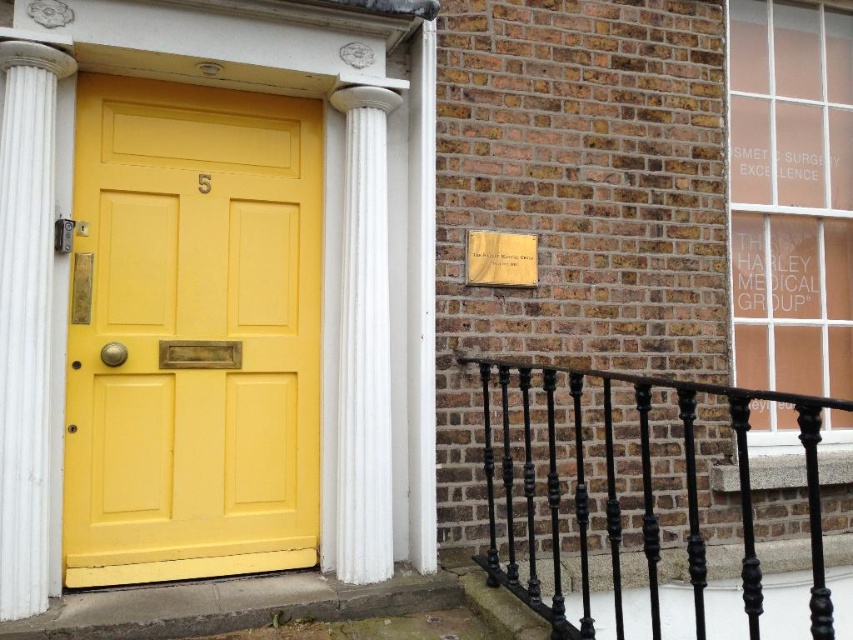
Question: Is black wrought iron railing at lower right above white marble column at left?

Choices:
 (A) yes
 (B) no

Answer: (B)

Question: Estimate the real-world distances between objects in this image. Which object is farther from the matte yellow door at center?

Choices:
 (A) white marble column at left
 (B) white marble column at center

Answer: (A)

Question: Is matte yellow door at center positioned at the back of white marble column at center?

Choices:
 (A) yes
 (B) no

Answer: (B)

Question: Which point is closer to the camera?

Choices:
 (A) (305, 157)
 (B) (651, 480)
 (C) (392, 554)

Answer: (C)

Question: Which object is farther from the camera taking this photo?

Choices:
 (A) black wrought iron railing at lower right
 (B) white marble column at center
 (C) matte yellow door at center
 (D) white marble column at left

Answer: (B)

Question: Does white marble column at left come behind white marble column at center?

Choices:
 (A) yes
 (B) no

Answer: (B)